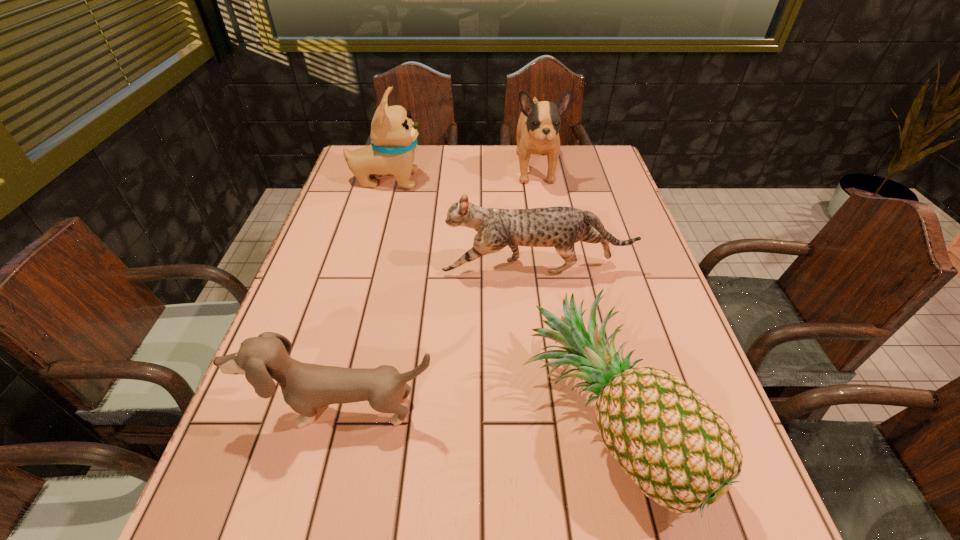
Locate an element on the screen. The width and height of the screenshot is (960, 540). free space between the pineapple and the nearest puppy is located at coordinates (473, 415).

At what (x,y) coordinates should I click in order to perform the action: click on object identified as the fourth closest to the pineapple. Please return your answer as a coordinate pair (x, y). Looking at the image, I should click on (393, 134).

Select which object is the fourth closest to the cat. Please provide its 2D coordinates. Your answer should be formatted as a tuple, i.e. [(x, y)], where the tuple contains the x and y coordinates of a point satisfying the conditions above.

[(393, 134)]

Locate an element on the screen. puppy that stands as the closest to the rightmost puppy is located at coordinates (393, 134).

You are a GUI agent. You are given a task and a screenshot of the screen. Output one action in this format:
    pyautogui.click(x=<x>, y=<y>)
    Task: Click on the closest puppy to the rightmost puppy
    
    Given the screenshot: What is the action you would take?
    pyautogui.click(x=393, y=134)

Where is `vacant space that satisfies the following two spatial constraints: 1. at the face of the pineapple; 2. on the right side of the rightmost puppy`? The height and width of the screenshot is (540, 960). vacant space that satisfies the following two spatial constraints: 1. at the face of the pineapple; 2. on the right side of the rightmost puppy is located at coordinates (578, 420).

This screenshot has height=540, width=960. I want to click on vacant space that satisfies the following two spatial constraints: 1. on the face of the third farthest object; 2. at the face of the nearest puppy, so click(x=556, y=410).

Where is `free point that satisfies the following two spatial constraints: 1. on the back side of the pineapple; 2. on the face of the cat`? The image size is (960, 540). free point that satisfies the following two spatial constraints: 1. on the back side of the pineapple; 2. on the face of the cat is located at coordinates (572, 268).

The image size is (960, 540). I want to click on free spot that satisfies the following two spatial constraints: 1. on the face of the cat; 2. at the face of the nearest puppy, so click(x=556, y=410).